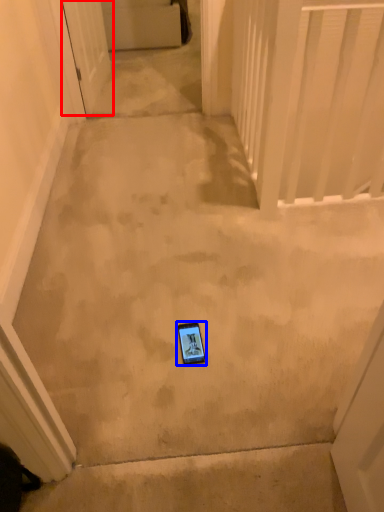
Question: Which object is further to the camera taking this photo, door (highlighted by a red box) or mobile phone (highlighted by a blue box)?

Choices:
 (A) door
 (B) mobile phone

Answer: (A)